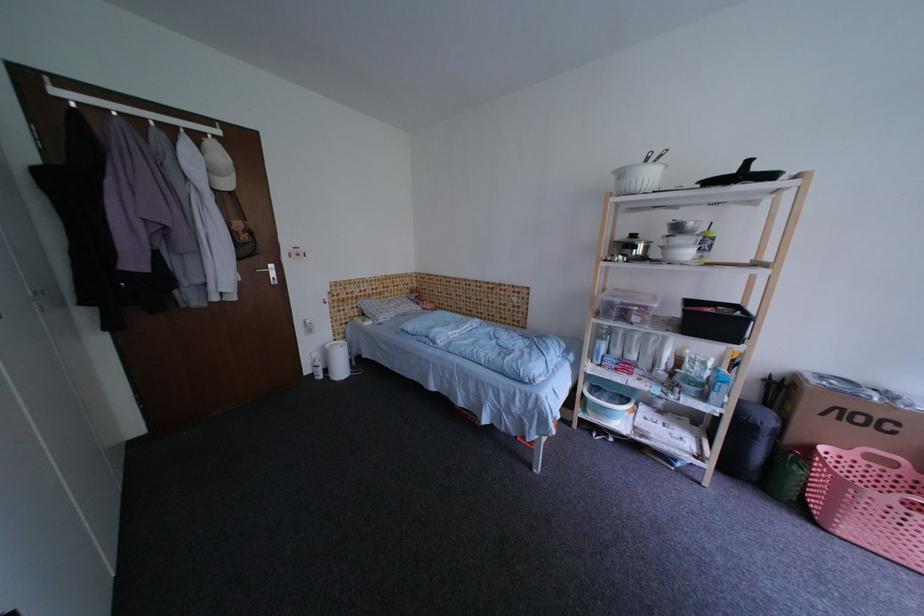
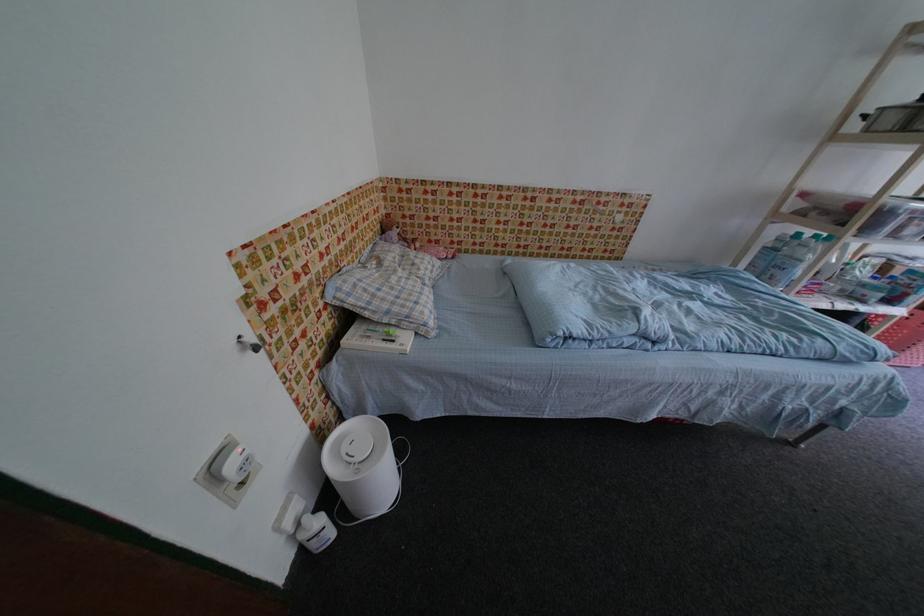
Where in the second image is the point corresponding to pixel 396 297 from the first image?

(370, 246)